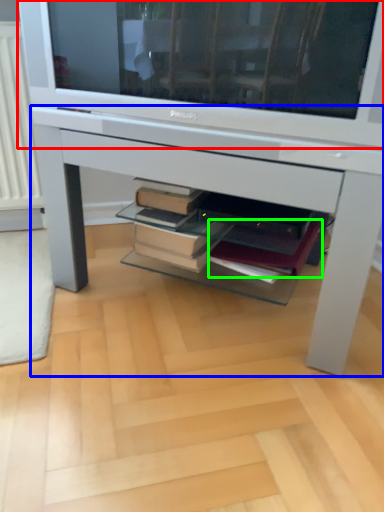
Question: Which is farther away from television (highlighted by a red box)? desk (highlighted by a blue box) or paperback book (highlighted by a green box)?

Choices:
 (A) desk
 (B) paperback book

Answer: (B)